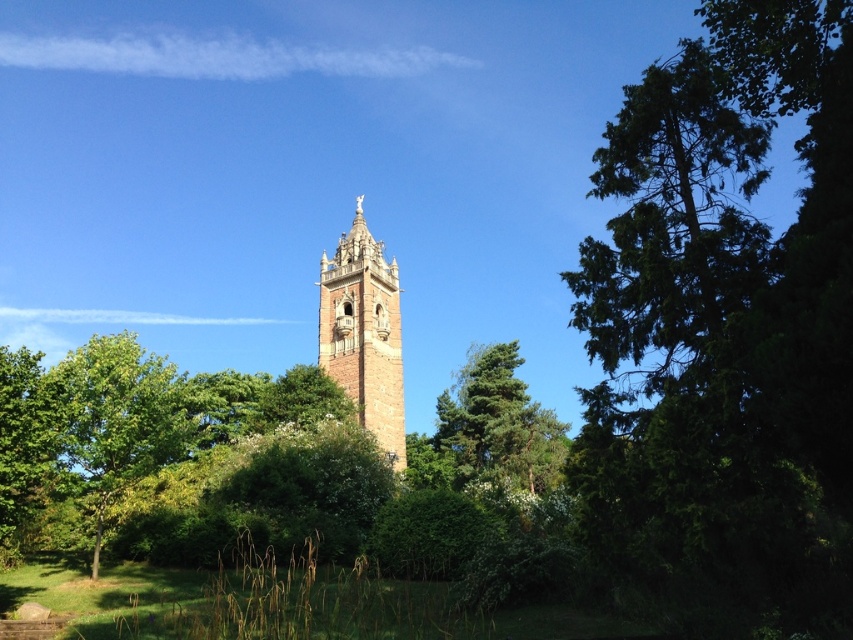
You are standing in the park and want to take a photo of the brown stone tower at center and the green leafy tree at lower left. Which object should you zoom in on to capture both in the frame without moving your camera?

The brown stone tower at center is wider than the green leafy tree at lower left, so you should zoom in on the green leafy tree at lower left to include both in the frame without moving the camera.

You are standing in the park and see the green textured tree at center and the brown stone tower at center. Which one is shorter?

The green textured tree at center is shorter than the brown stone tower at center.